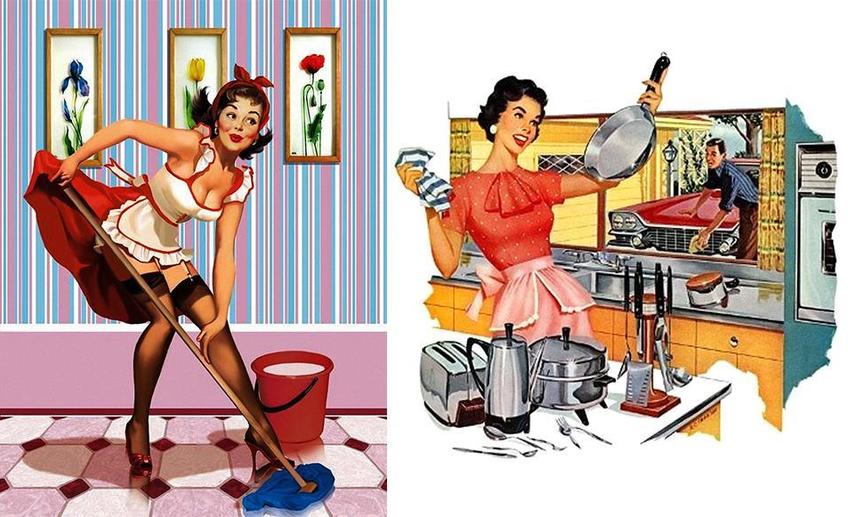
Identify the location of bucket. The height and width of the screenshot is (517, 848). click(304, 409).